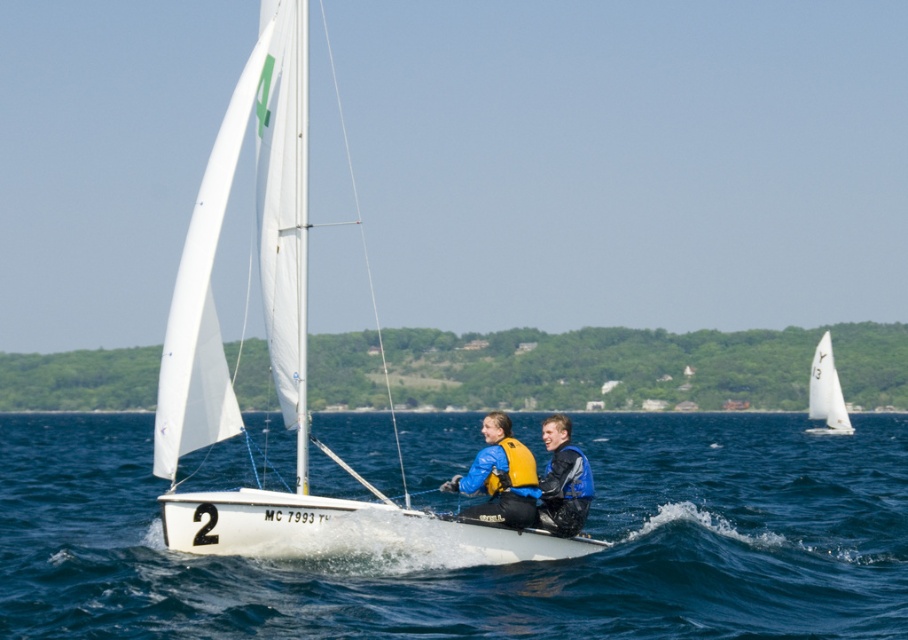
Question: Which of the following is the farthest from the observer?

Choices:
 (A) white sail at upper right
 (B) white water at center
 (C) blue leather jacket at center
 (D) yellow life vest at center

Answer: (A)

Question: Which object is closer to the camera taking this photo?

Choices:
 (A) white water at center
 (B) yellow life vest at center

Answer: (A)

Question: Considering the relative positions of blue leather jacket at center and yellow matte life jacket at center in the image provided, where is blue leather jacket at center located with respect to yellow matte life jacket at center?

Choices:
 (A) below
 (B) above

Answer: (B)

Question: Does white sail at upper right come in front of yellow matte life jacket at center?

Choices:
 (A) no
 (B) yes

Answer: (A)

Question: Can you confirm if white water at center is bigger than white sail at upper right?

Choices:
 (A) yes
 (B) no

Answer: (A)

Question: Estimate the real-world distances between objects in this image. Which object is closer to the yellow matte life jacket at center?

Choices:
 (A) blue leather jacket at center
 (B) white sail at upper right
 (C) yellow life vest at center
 (D) white water at center

Answer: (C)